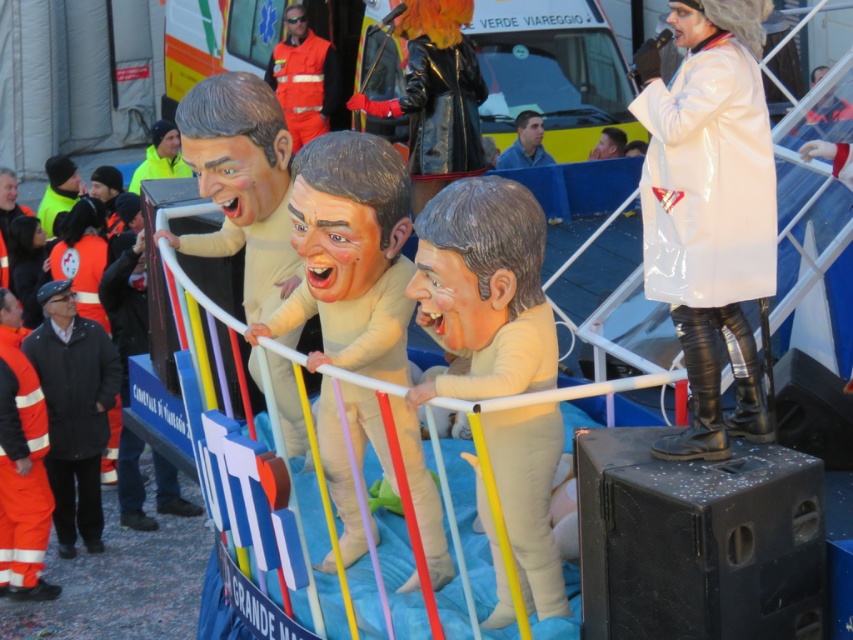
Question: Which object is farther from the camera taking this photo?

Choices:
 (A) shiny white coat at center
 (B) smooth beige mask at center

Answer: (B)

Question: Does smooth beige mask at center appear under blue fabric at center?

Choices:
 (A) yes
 (B) no

Answer: (A)

Question: Is smooth beige baby at center smaller than black fabric jacket at lower left?

Choices:
 (A) no
 (B) yes

Answer: (A)

Question: Does shiny white coat at center come in front of smooth beige baby at center?

Choices:
 (A) yes
 (B) no

Answer: (A)

Question: Which is farther from the smooth beige baby at center?

Choices:
 (A) shiny white coat at center
 (B) black fabric jacket at lower left

Answer: (B)

Question: Which point appears farthest from the camera in this image?

Choices:
 (A) (346, 404)
 (B) (91, 390)
 (C) (520, 122)
 (D) (677, 444)

Answer: (C)